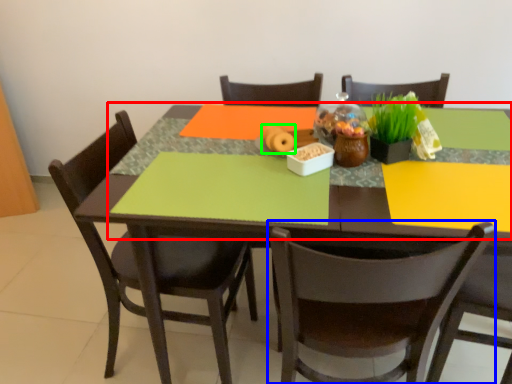
Question: Estimate the real-world distances between objects in this image. Which object is farther from tablecloth (highlighted by a red box), chair (highlighted by a blue box) or food (highlighted by a green box)?

Choices:
 (A) chair
 (B) food

Answer: (B)